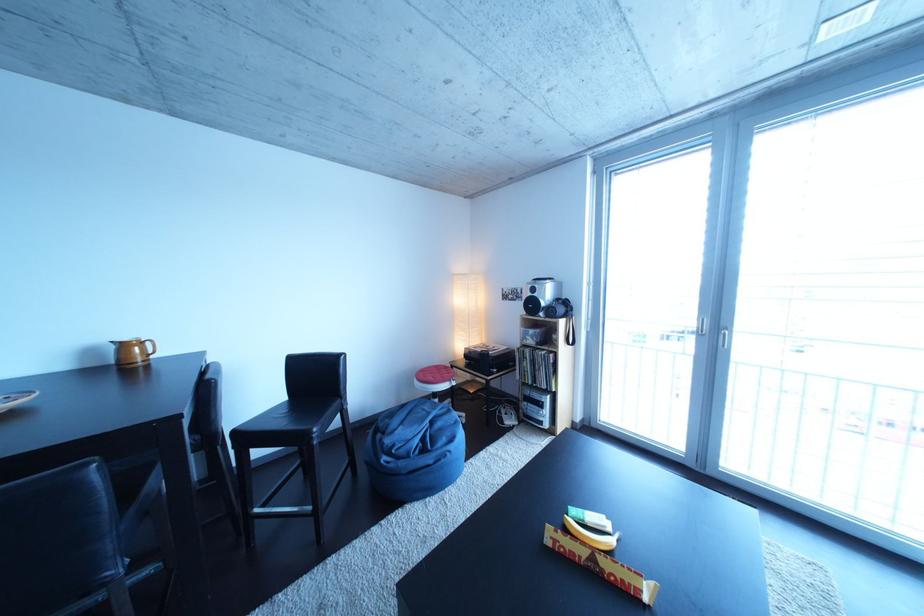
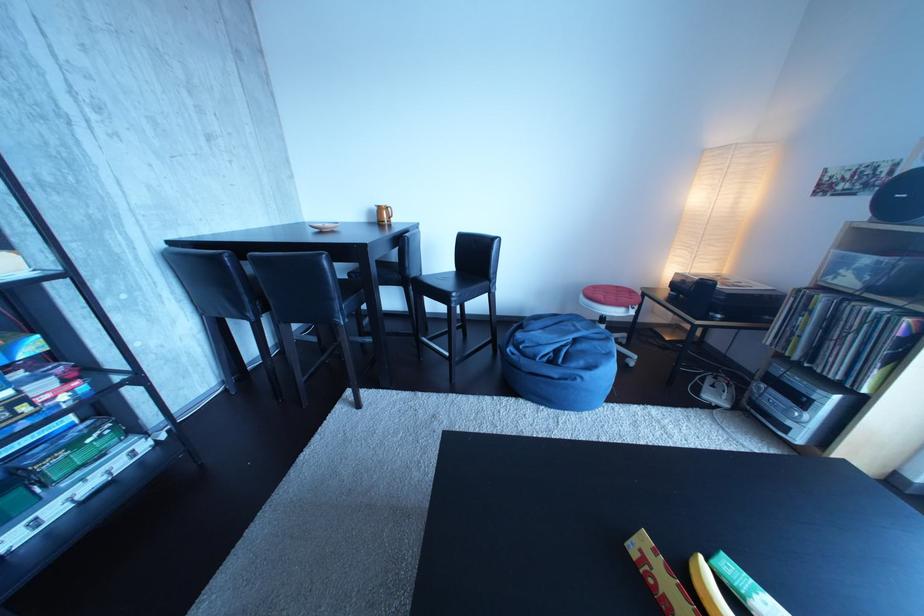
The first image is from the beginning of the video and the second image is from the end. How did the camera likely rotate when shooting the video?

The camera's rotation is toward left-down.